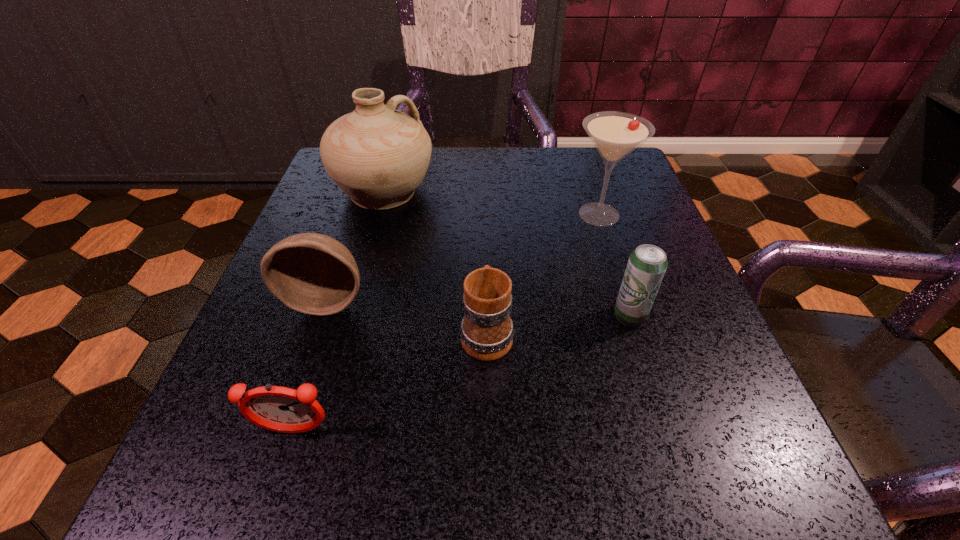
You are a GUI agent. You are given a task and a screenshot of the screen. Output one action in this format:
    pyautogui.click(x=<x>, y=<y>)
    Task: Click on the object that is the second closest one to the alarm clock
    The height and width of the screenshot is (540, 960).
    Given the screenshot: What is the action you would take?
    pyautogui.click(x=487, y=330)

Point out which object is positioned as the fifth nearest to the martini. Please provide its 2D coordinates. Your answer should be formatted as a tuple, i.e. [(x, y)], where the tuple contains the x and y coordinates of a point satisfying the conditions above.

[(281, 409)]

Image resolution: width=960 pixels, height=540 pixels. I want to click on vacant position in the image that satisfies the following two spatial constraints: 1. on the side of the fourth object from left to right with the handle; 2. on the left side of the beer can, so click(x=487, y=315).

Locate an element on the screen. The height and width of the screenshot is (540, 960). vacant area that satisfies the following two spatial constraints: 1. on the side of the beer can with the handle; 2. on the left side of the third object from right to left is located at coordinates (487, 315).

At what (x,y) coordinates should I click in order to perform the action: click on blank area in the image that satisfies the following two spatial constraints: 1. on the side of the beer can with the handle; 2. on the right side of the fourth object from left to right. Please return your answer as a coordinate pair (x, y). This screenshot has height=540, width=960. Looking at the image, I should click on (487, 315).